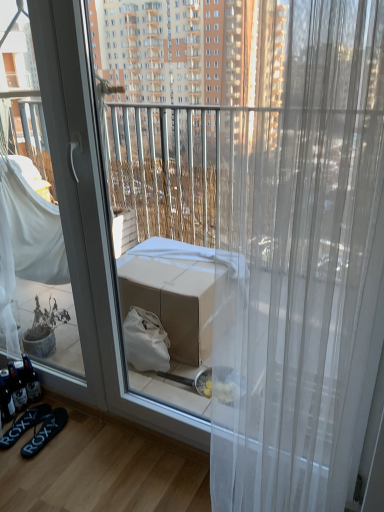
Question: Is black rubber flip-flops at lower left, the first footwear when ordered from right to left, next to transparent sheer curtain at center?

Choices:
 (A) no
 (B) yes

Answer: (A)

Question: From a real-world perspective, is black rubber flip-flops at lower left, the first footwear when ordered from right to left, located beneath transparent sheer curtain at center?

Choices:
 (A) yes
 (B) no

Answer: (A)

Question: From the image's perspective, does black rubber flip-flops at lower left, the first footwear when ordered from right to left, appear lower than transparent sheer curtain at center?

Choices:
 (A) no
 (B) yes

Answer: (B)

Question: Is black rubber flip-flops at lower left, the first footwear when ordered from right to left, oriented towards transparent sheer curtain at center?

Choices:
 (A) yes
 (B) no

Answer: (B)

Question: From a real-world perspective, is black rubber flip-flops at lower left, which appears as the 2th footwear when viewed from the left, on transparent sheer curtain at center?

Choices:
 (A) yes
 (B) no

Answer: (B)

Question: From the image's perspective, relative to black fabric flip-flops at lower left, placed as the first footwear when sorted from left to right, is black rubber flip-flops at lower left, which appears as the 2th footwear when viewed from the left, above or below?

Choices:
 (A) above
 (B) below

Answer: (B)

Question: Is black rubber flip-flops at lower left, which appears as the 2th footwear when viewed from the left, wider or thinner than black fabric flip-flops at lower left, placed as the first footwear when sorted from left to right?

Choices:
 (A) thin
 (B) wide

Answer: (A)

Question: From a real-world perspective, is black rubber flip-flops at lower left, which appears as the 2th footwear when viewed from the left, above or below black fabric flip-flops at lower left, placed as the first footwear when sorted from left to right?

Choices:
 (A) below
 (B) above

Answer: (A)

Question: Relative to black fabric flip-flops at lower left, placed as the first footwear when sorted from left to right, is black rubber flip-flops at lower left, which appears as the 2th footwear when viewed from the left, in front or behind?

Choices:
 (A) front
 (B) behind

Answer: (A)

Question: In the image, is transparent sheer curtain at center positioned in front of or behind black rubber flip-flops at lower left, the first footwear when ordered from right to left?

Choices:
 (A) front
 (B) behind

Answer: (A)

Question: Based on their sizes in the image, would you say transparent sheer curtain at center is bigger or smaller than black rubber flip-flops at lower left, which appears as the 2th footwear when viewed from the left?

Choices:
 (A) big
 (B) small

Answer: (A)

Question: Looking at their shapes, would you say transparent sheer curtain at center is wider or thinner than black rubber flip-flops at lower left, the first footwear when ordered from right to left?

Choices:
 (A) thin
 (B) wide

Answer: (A)

Question: Is transparent sheer curtain at center taller or shorter than black rubber flip-flops at lower left, the first footwear when ordered from right to left?

Choices:
 (A) short
 (B) tall

Answer: (B)

Question: Is black rubber flip-flops at lower left, the first footwear when ordered from right to left, in front of or behind transparent sheer curtain at center in the image?

Choices:
 (A) front
 (B) behind

Answer: (B)

Question: In terms of height, does black rubber flip-flops at lower left, which appears as the 2th footwear when viewed from the left, look taller or shorter compared to transparent sheer curtain at center?

Choices:
 (A) short
 (B) tall

Answer: (A)